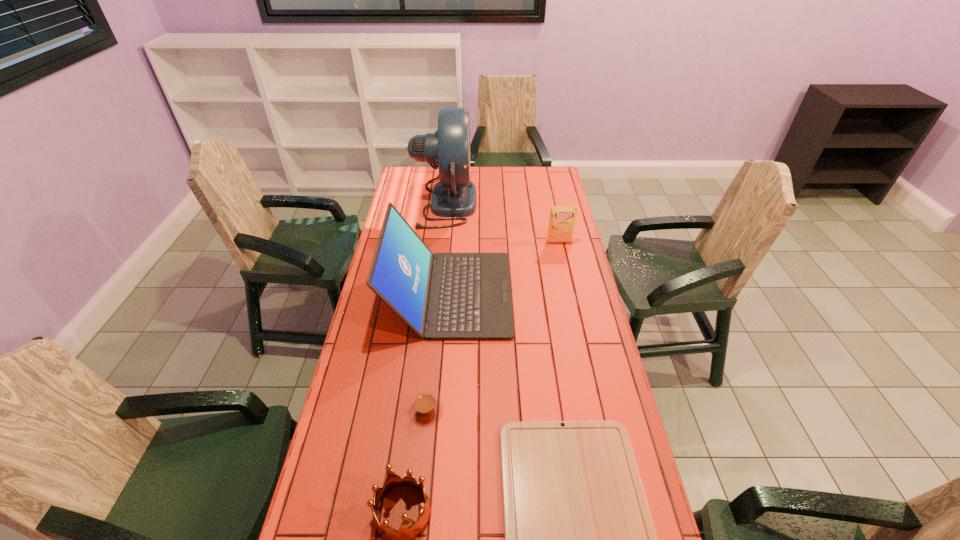
Find the location of a particular element. Image resolution: width=960 pixels, height=540 pixels. the farthest object is located at coordinates (454, 197).

Locate an element on the screen. fan is located at coordinates (454, 197).

Locate an element on the screen. This screenshot has width=960, height=540. the fifth shortest object is located at coordinates (444, 296).

What are the coordinates of `laptop computer` in the screenshot? It's located at (444, 296).

At what (x,y) coordinates should I click in order to perform the action: click on the second farthest object. Please return your answer as a coordinate pair (x, y). Image resolution: width=960 pixels, height=540 pixels. Looking at the image, I should click on (562, 220).

Locate an element on the screen. The height and width of the screenshot is (540, 960). crisp (potato chip) is located at coordinates (562, 220).

Identify the location of the second shortest object. (426, 409).

Where is `blank area located in front of the tallest object to blow air`? blank area located in front of the tallest object to blow air is located at coordinates (519, 204).

Locate an element on the screen. free space located 0.080m on the screen of the laptop computer is located at coordinates (533, 294).

This screenshot has height=540, width=960. Find the location of `vacant space located 0.190m on the front of the fifth nearest object with the logo`. vacant space located 0.190m on the front of the fifth nearest object with the logo is located at coordinates (566, 276).